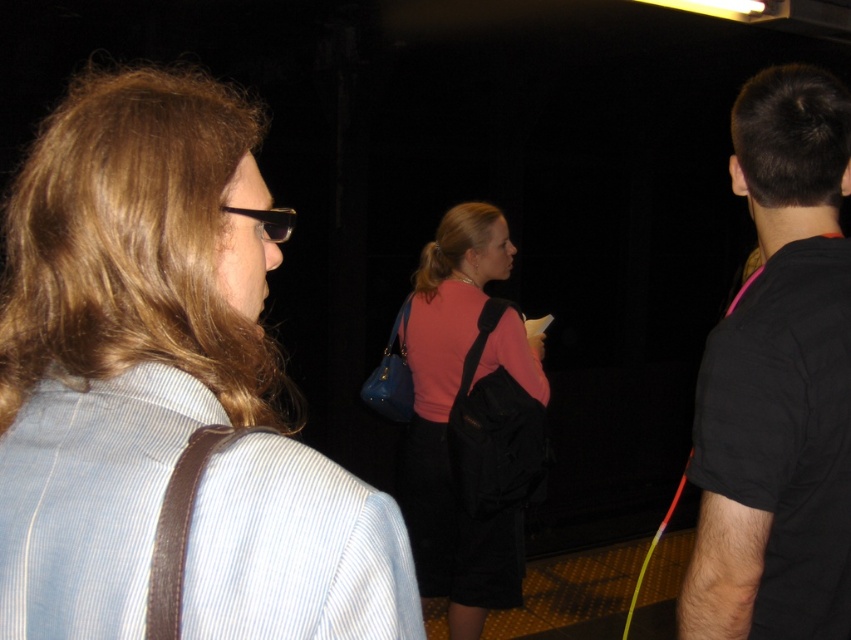
Can you confirm if light blue striped shirt at left is taller than black plastic sunglasses at upper left?

Yes, light blue striped shirt at left is taller than black plastic sunglasses at upper left.

Identify the location of light blue striped shirt at left. This screenshot has width=851, height=640. (123, 337).

Who is higher up, black matte shirt at right or black plastic sunglasses at upper left?

black plastic sunglasses at upper left is higher up.

Which is in front, point (835, 168) or point (233, 211)?

Point (233, 211) is in front.

Which is behind, point (785, 308) or point (280, 227)?

Point (785, 308)

Where is `black matte shirt at right`? The image size is (851, 640). black matte shirt at right is located at coordinates (778, 384).

Does pink matte sweater at center come behind black plastic sunglasses at upper left?

Yes, pink matte sweater at center is further from the viewer.

Describe the element at coordinates (449, 429) in the screenshot. The width and height of the screenshot is (851, 640). I see `pink matte sweater at center` at that location.

Between point (475, 205) and point (263, 227), which one is positioned in front?

Positioned in front is point (263, 227).

Where is `pink matte sweater at center`? The width and height of the screenshot is (851, 640). pink matte sweater at center is located at coordinates (449, 429).